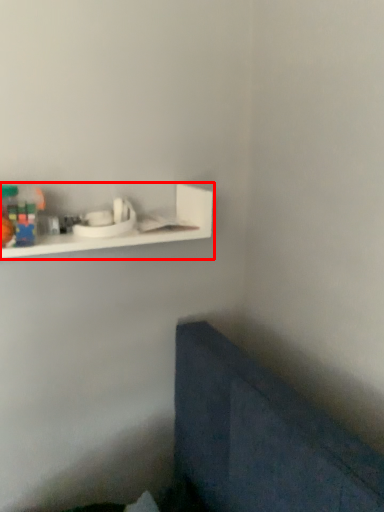
Question: From the image's perspective, what is the correct spatial relationship of shelf (annotated by the red box) in relation to toy?

Choices:
 (A) above
 (B) below

Answer: (A)